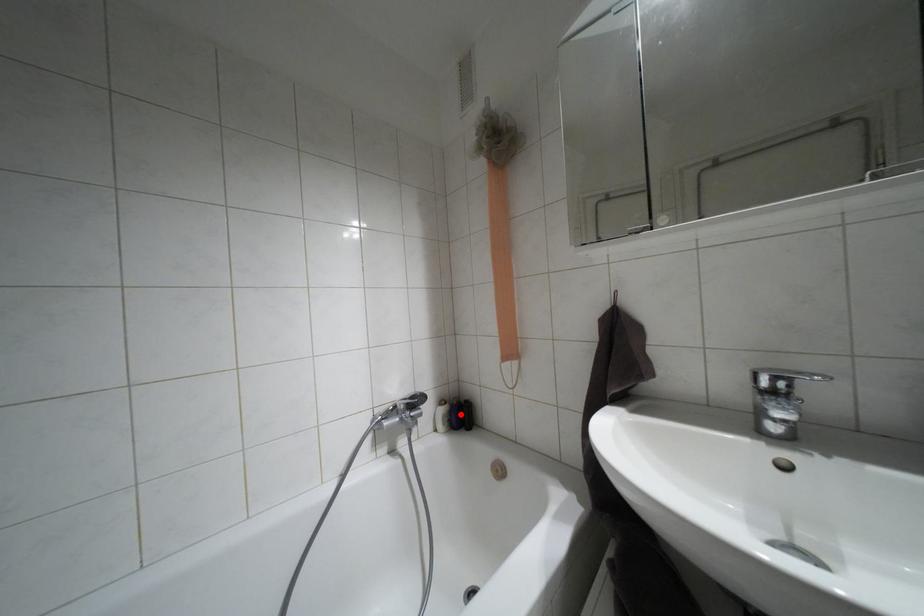
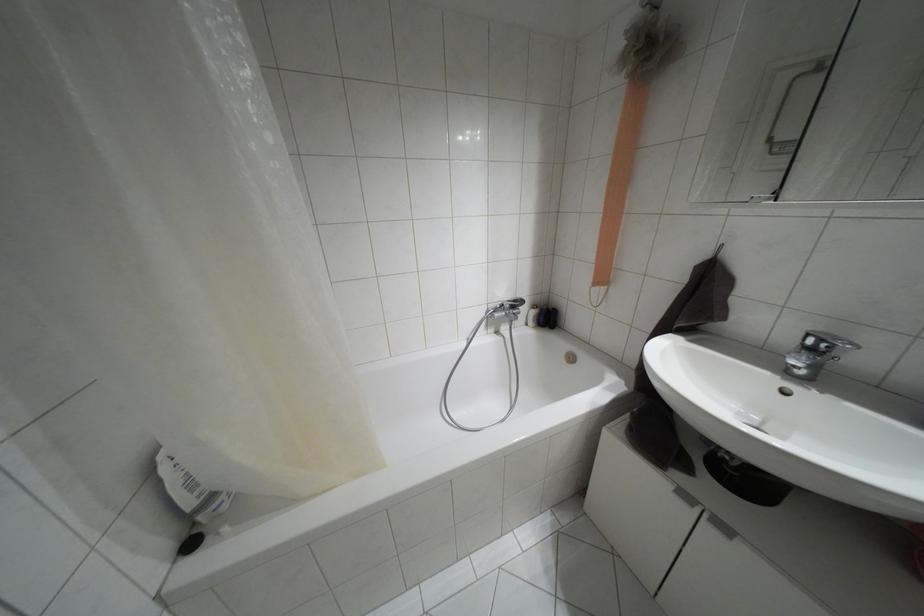
Find the pixel in the second image that matches the highlighted location in the first image.

(546, 317)